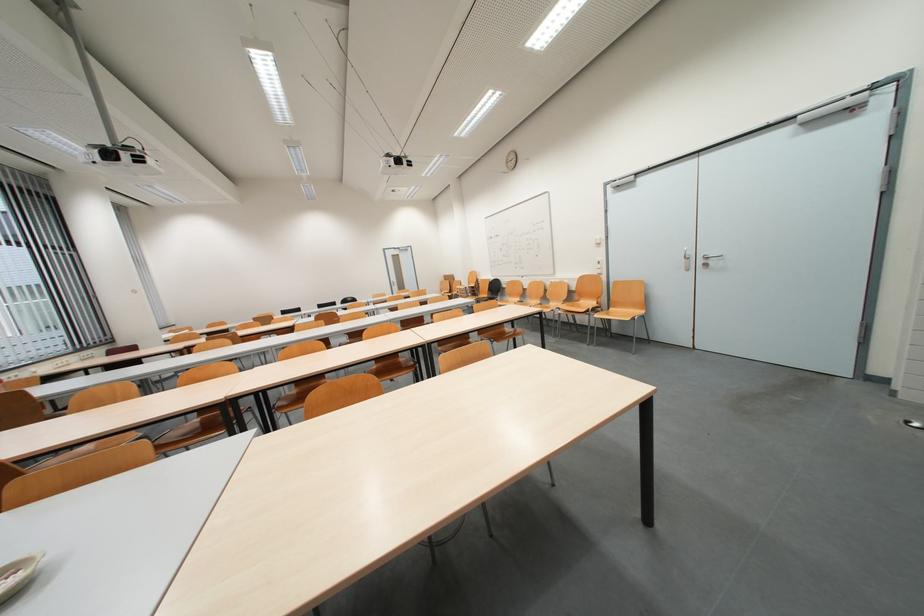
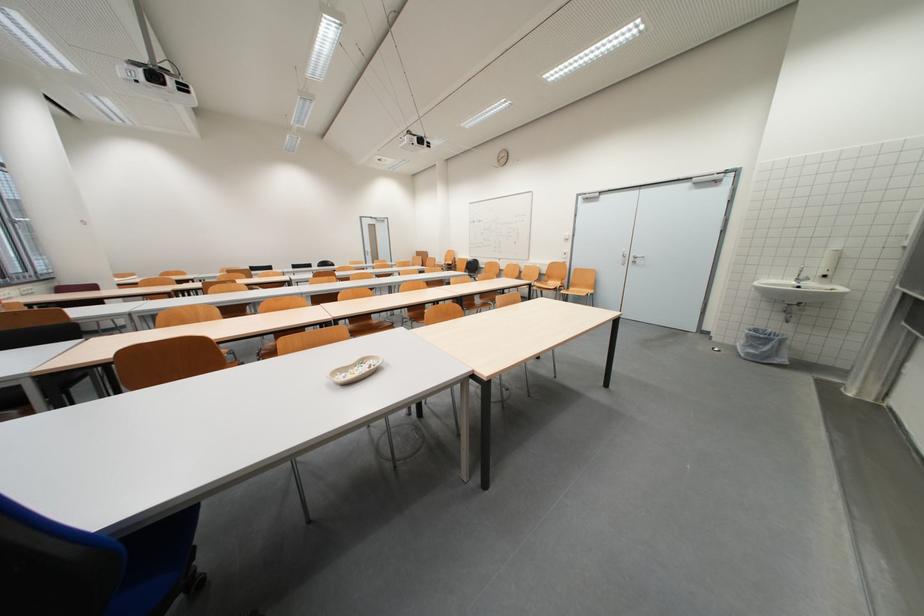
Find the pixel in the second image that matches point 546,318 in the first image.

(537, 291)